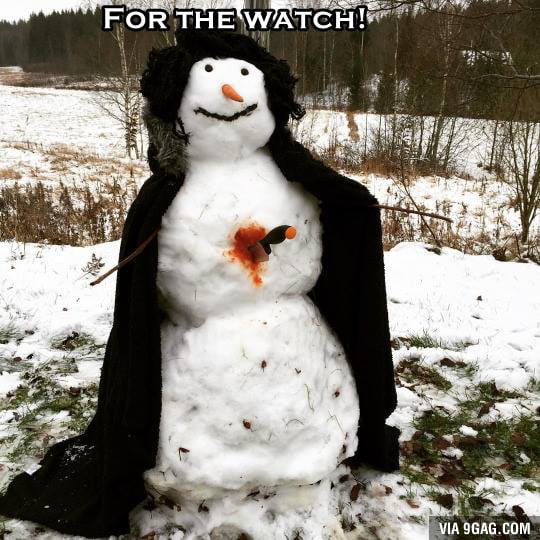
Identify the location of coat. (152, 206).